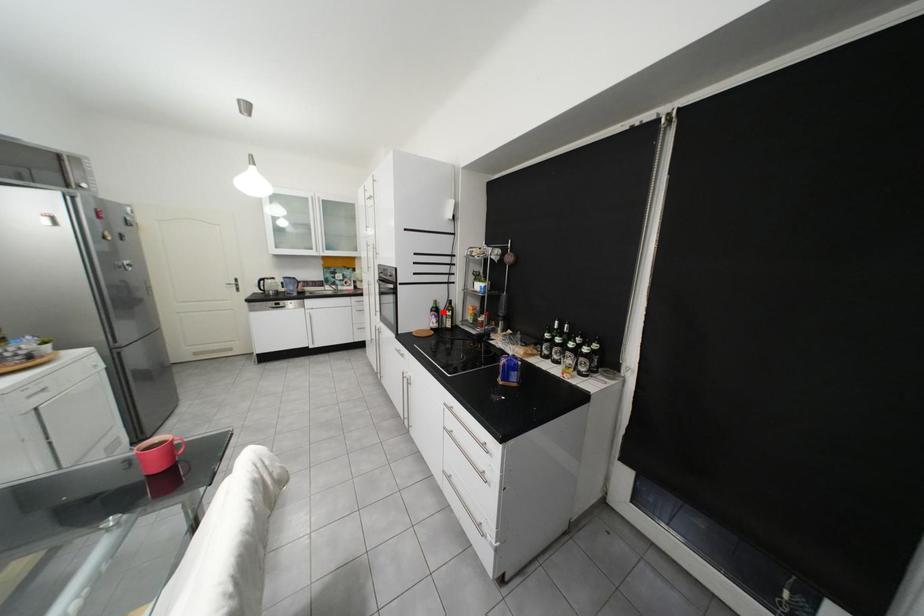
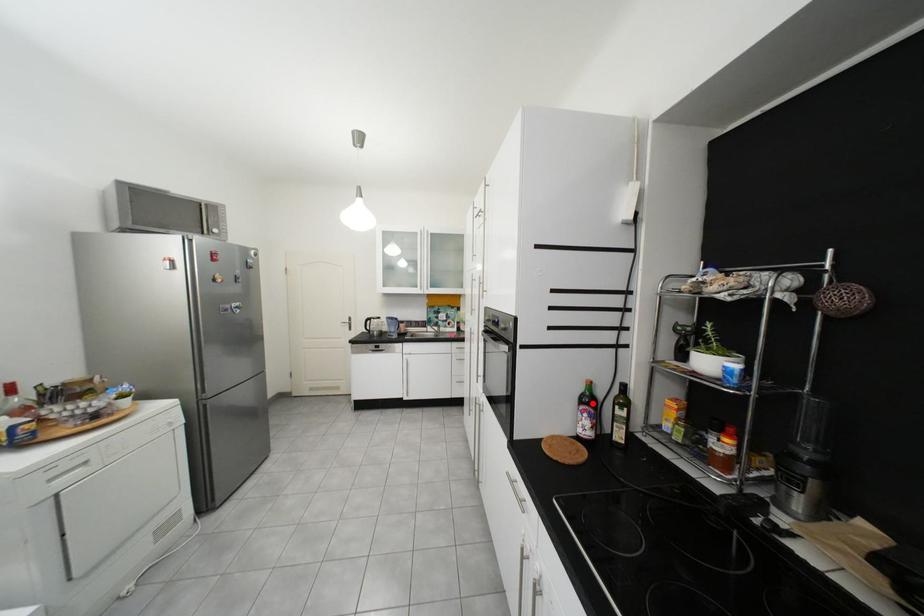
Consider the image. I am providing you with two images of the same scene from different viewpoints. A red point is marked on the first image and another point is marked on the second image. Is the marked point in image1 the same physical position as the marked point in image2?

Yes